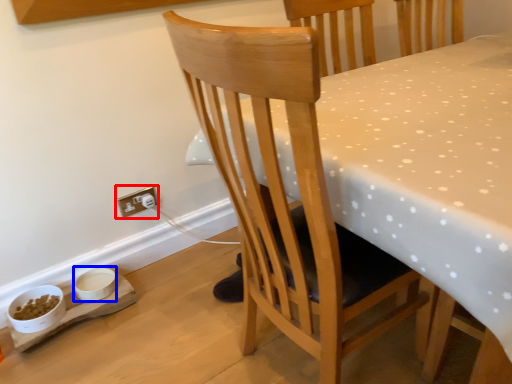
Question: Which object appears farthest to the camera in this image, electric outlet (highlighted by a red box) or bowl (highlighted by a blue box)?

Choices:
 (A) electric outlet
 (B) bowl

Answer: (A)